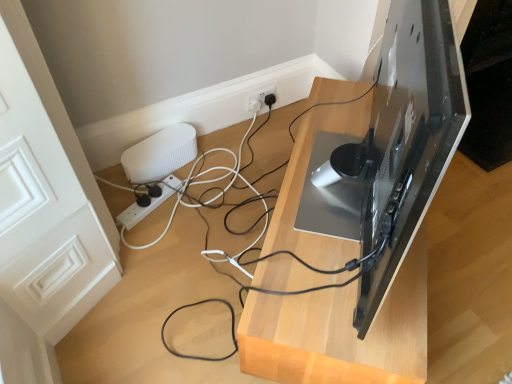
Question: Considering the positions of point (190, 134) and point (421, 259), is point (190, 134) closer or farther from the camera than point (421, 259)?

Choices:
 (A) closer
 (B) farther

Answer: (B)

Question: From a real-world perspective, is white ribbed speaker at lower left positioned above or below black glossy tv stand at upper right?

Choices:
 (A) above
 (B) below

Answer: (B)

Question: Which is nearer to the white ribbed speaker at lower left?

Choices:
 (A) glossy black monitor at upper right
 (B) white plastic power strip at lower center
 (C) black glossy tv stand at upper right

Answer: (B)

Question: Based on their relative distances, which object is nearer to the black glossy tv stand at upper right?

Choices:
 (A) white ribbed speaker at lower left
 (B) glossy black monitor at upper right
 (C) white plastic power strip at lower center

Answer: (B)